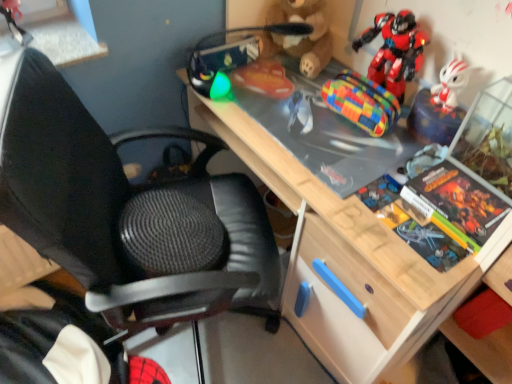
Question: From the image's perspective, is rubberized orange toy at upper center, arranged as the first toy when viewed from the left, over wooden desk at center?

Choices:
 (A) no
 (B) yes

Answer: (B)

Question: Does rubberized orange toy at upper center, arranged as the first toy when viewed from the left, have a lesser height compared to wooden desk at center?

Choices:
 (A) no
 (B) yes

Answer: (B)

Question: Is rubberized orange toy at upper center, arranged as the first toy when viewed from the left, directly adjacent to wooden desk at center?

Choices:
 (A) yes
 (B) no

Answer: (B)

Question: Is rubberized orange toy at upper center, arranged as the first toy when viewed from the left, further to the viewer compared to wooden desk at center?

Choices:
 (A) yes
 (B) no

Answer: (A)

Question: Considering the relative sizes of rubberized orange toy at upper center, which is the 4th toy in right-to-left order, and wooden desk at center in the image provided, is rubberized orange toy at upper center, which is the 4th toy in right-to-left order, taller than wooden desk at center?

Choices:
 (A) no
 (B) yes

Answer: (A)

Question: Choose the correct answer: Is multicolored woven pouch at center, arranged as the second toy when viewed from the right, inside hardcover book at right or outside it?

Choices:
 (A) inside
 (B) outside

Answer: (B)

Question: Considering the positions of multicolored woven pouch at center, arranged as the second toy when viewed from the right, and hardcover book at right in the image, is multicolored woven pouch at center, arranged as the second toy when viewed from the right, taller or shorter than hardcover book at right?

Choices:
 (A) short
 (B) tall

Answer: (B)

Question: Looking at their shapes, would you say multicolored woven pouch at center, arranged as the second toy when viewed from the right, is wider or thinner than hardcover book at right?

Choices:
 (A) thin
 (B) wide

Answer: (A)

Question: Considering the positions of point (362, 119) and point (413, 183), is point (362, 119) closer or farther from the camera than point (413, 183)?

Choices:
 (A) farther
 (B) closer

Answer: (A)

Question: Visually, is wooden desk at center positioned to the left or to the right of shiny plastic robot at upper right, which is counted as the 4th toy, starting from the left?

Choices:
 (A) left
 (B) right

Answer: (A)

Question: From a real-world perspective, relative to shiny plastic robot at upper right, which is counted as the 4th toy, starting from the left, is wooden desk at center vertically above or below?

Choices:
 (A) above
 (B) below

Answer: (B)

Question: Is wooden desk at center bigger or smaller than shiny plastic robot at upper right, which is counted as the 4th toy, starting from the left?

Choices:
 (A) small
 (B) big

Answer: (B)

Question: Considering the positions of point (309, 203) and point (391, 52), is point (309, 203) closer or farther from the camera than point (391, 52)?

Choices:
 (A) closer
 (B) farther

Answer: (A)

Question: Do you think rubberized orange toy at upper center, arranged as the first toy when viewed from the left, is within shiny plastic robot at upper right, which is counted as the 4th toy, starting from the left, or outside of it?

Choices:
 (A) outside
 (B) inside

Answer: (A)

Question: Does point click(x=282, y=28) appear closer or farther from the camera than point click(x=411, y=72)?

Choices:
 (A) farther
 (B) closer

Answer: (A)